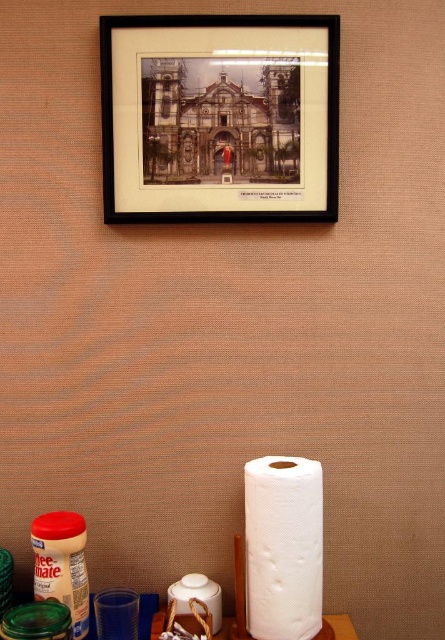
Based on the photo, you are organizing items on a shelf and need to know which object is bigger. Which is larger between the black matte picture frame at upper center and the white matte toilet paper at lower center?

The black matte picture frame at upper center is larger in size than the white matte toilet paper at lower center.

In the scene shown: What is the location of the point with coordinates (219, 116) in the image?

The point with coordinates (219, 116) is located on the black matte picture frame at upper center.

You are organizing a display on a shelf that can only accommodate items up to 30 cm in width. You have the black matte picture frame at upper center and the white matte toilet paper at lower center. Which item can fit on the shelf without exceeding the width limit?

The white matte toilet paper at lower center can fit on the shelf since its width is smaller than the black matte picture frame at upper center, which exceeds the 30 cm limit.